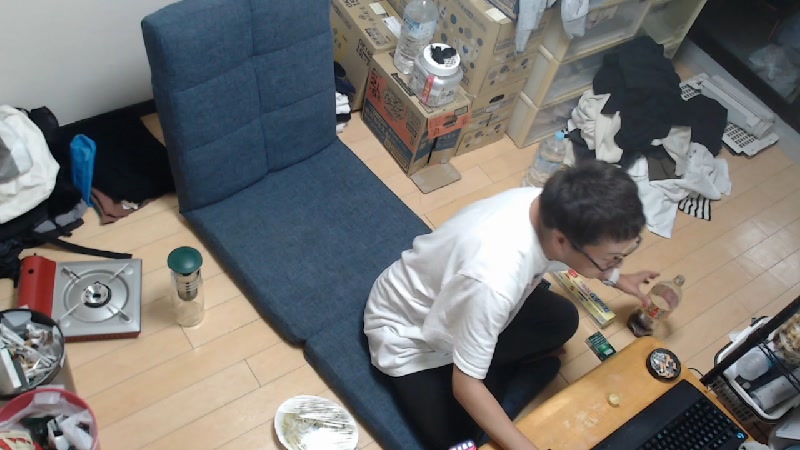
Identify the location of gas plate. This screenshot has height=450, width=800. (94, 293).